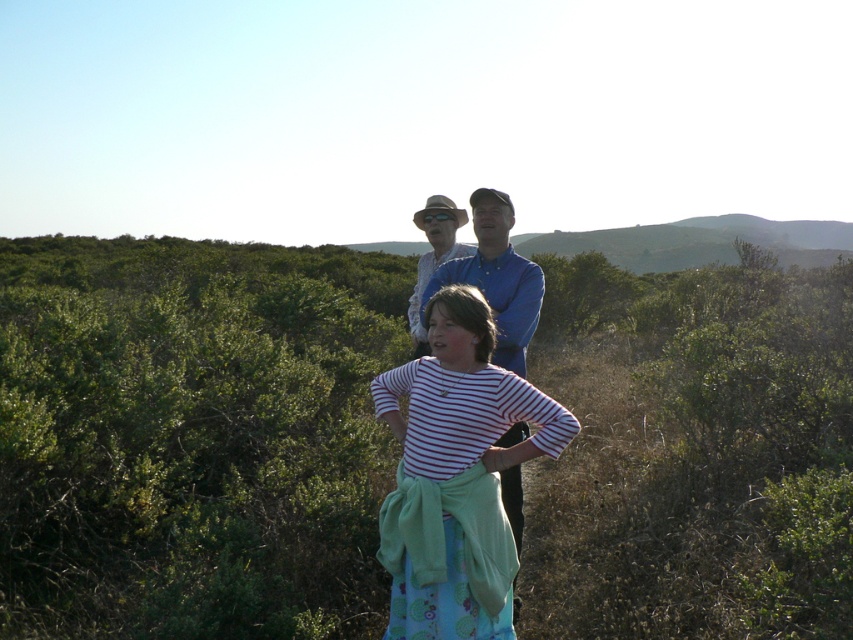
Question: Based on their relative distances, which object is nearer to the blue denim shirt at center?

Choices:
 (A) green leafy shrubs at center
 (B) striped cotton shirt at center

Answer: (B)

Question: Which object is positioned farthest from the striped cotton shirt at center?

Choices:
 (A) green leafy shrubs at center
 (B) blue denim shirt at center

Answer: (A)

Question: Is green leafy shrubs at center in front of blue denim shirt at center?

Choices:
 (A) no
 (B) yes

Answer: (B)

Question: Can you confirm if green leafy shrubs at center is thinner than matte white shirt at center?

Choices:
 (A) yes
 (B) no

Answer: (B)

Question: Can you confirm if green leafy shrubs at center is positioned above matte white shirt at center?

Choices:
 (A) no
 (B) yes

Answer: (B)

Question: Which object appears closest to the camera in this image?

Choices:
 (A) blue denim shirt at center
 (B) matte white shirt at center
 (C) striped cotton shirt at center

Answer: (C)